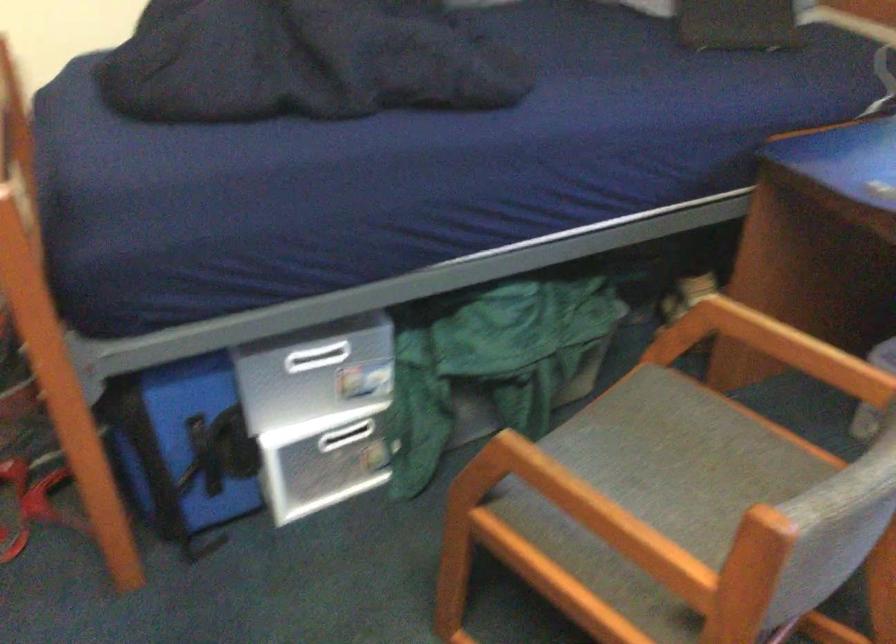
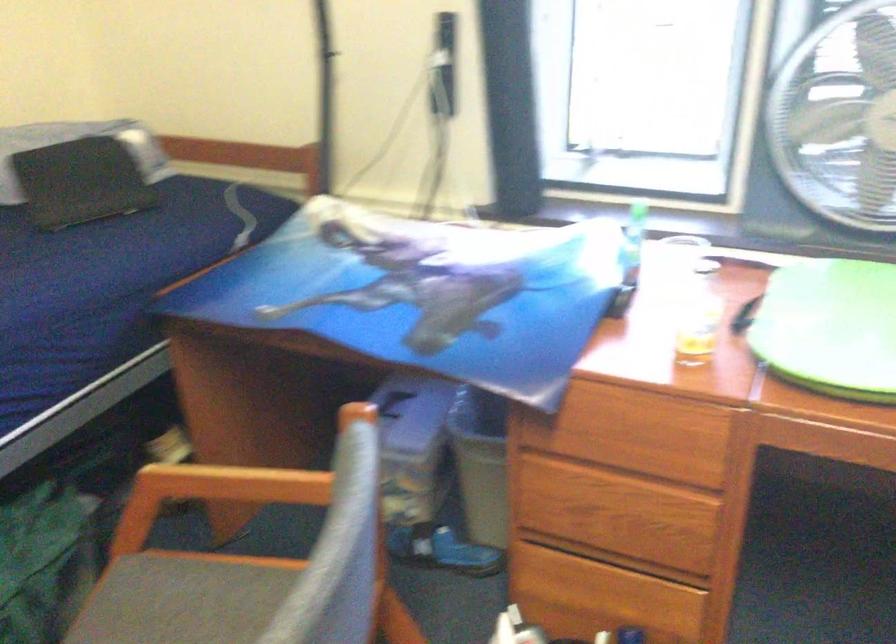
Question: How did the camera likely rotate?

Choices:
 (A) Left
 (B) Right
 (C) Up
 (D) Down

Answer: (B)